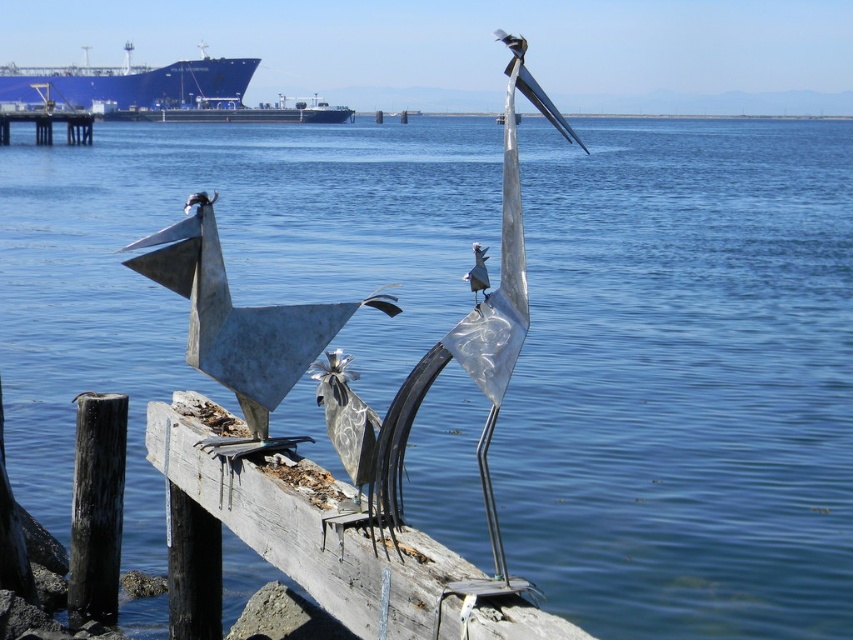
Between brushed metal ship at upper left and brushed metal dock at left, which one is positioned lower?

brushed metal dock at left is lower down.

Can you confirm if brushed metal ship at upper left is bigger than brushed metal dock at left?

Incorrect, brushed metal ship at upper left is not larger than brushed metal dock at left.

Which is behind, point (181, 77) or point (1, 145)?

The point (181, 77) is behind.

Image resolution: width=853 pixels, height=640 pixels. I want to click on brushed metal ship at upper left, so click(x=128, y=83).

Is metallic silver crane at center taller than brushed metal dock at left?

No.

Does metallic silver crane at center have a lesser height compared to brushed metal dock at left?

Correct, metallic silver crane at center is not as tall as brushed metal dock at left.

Is point (451, 339) behind point (9, 124)?

No, it is not.

You are a GUI agent. You are given a task and a screenshot of the screen. Output one action in this format:
    pyautogui.click(x=<x>, y=<y>)
    Task: Click on the metallic silver crane at center
    This screenshot has height=640, width=853.
    Given the screenshot: What is the action you would take?
    pyautogui.click(x=471, y=355)

Can you confirm if metallic silver crane at center is shorter than blue metallic ship at upper center?

Yes.

Is point (425, 365) positioned before point (167, 113)?

Yes, it is in front of point (167, 113).

What do you see at coordinates (471, 355) in the screenshot?
I see `metallic silver crane at center` at bounding box center [471, 355].

Find the location of a particular element. metallic silver crane at center is located at coordinates (471, 355).